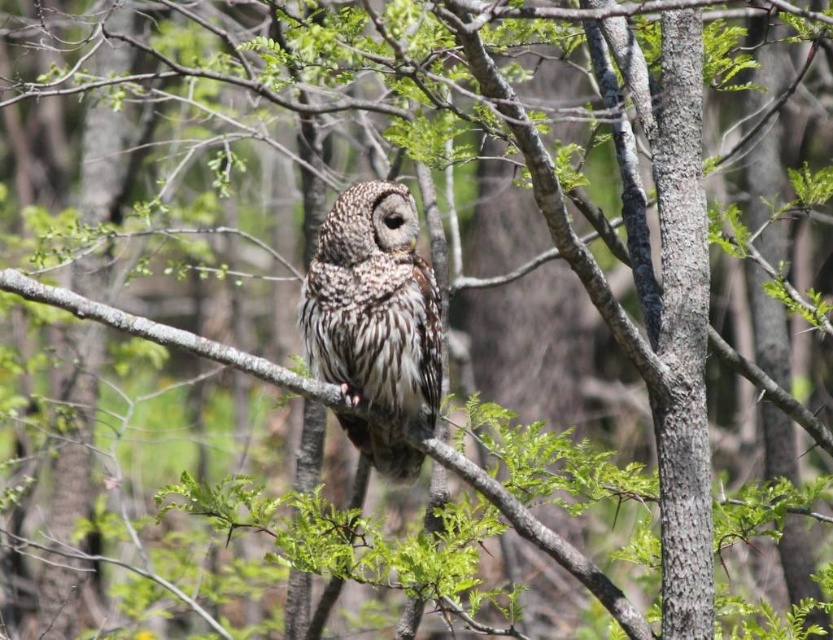
You are an ornithologist observing the speckled feathered owl at center and the brown textured branch at center. Which object has a smaller width?

The speckled feathered owl at center has a lesser width compared to the brown textured branch at center.

You are an ornithologist observing the speckled feathered owl at center and the brown textured branch at center in the forest. Which object takes up more space in the image?

The brown textured branch at center takes up more space in the image because the speckled feathered owl at center is smaller than the brown textured branch at center.